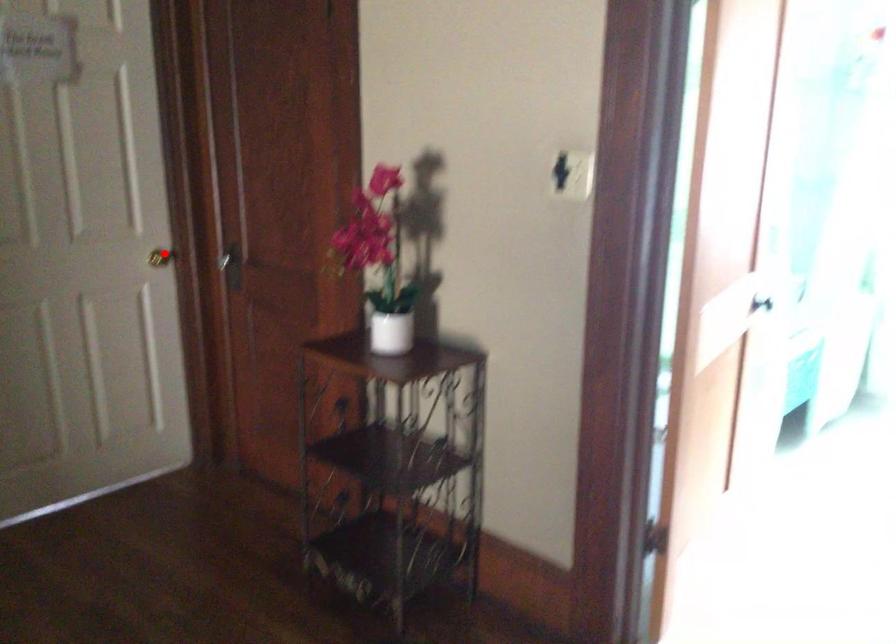
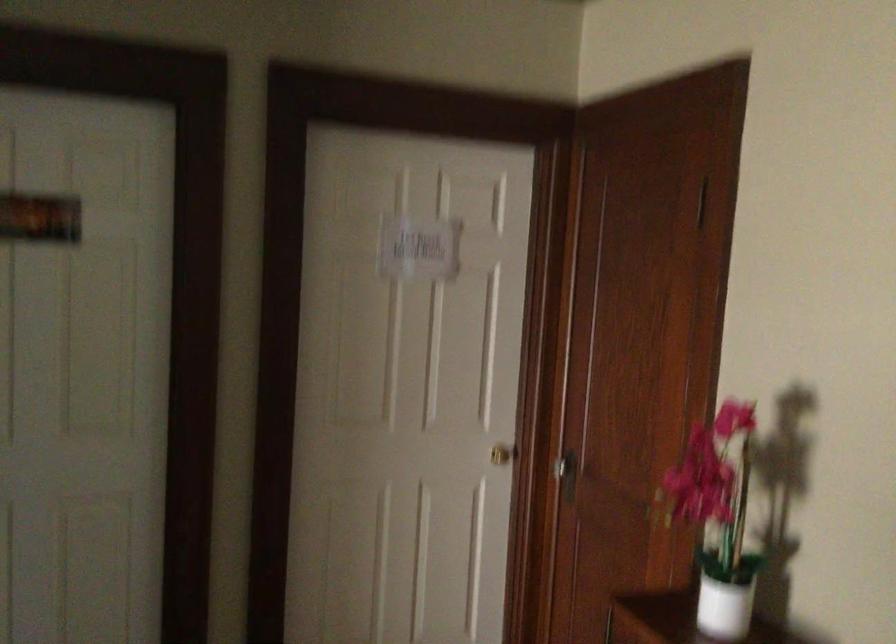
In the second image, find the point that corresponds to the highlighted location in the first image.

(503, 453)